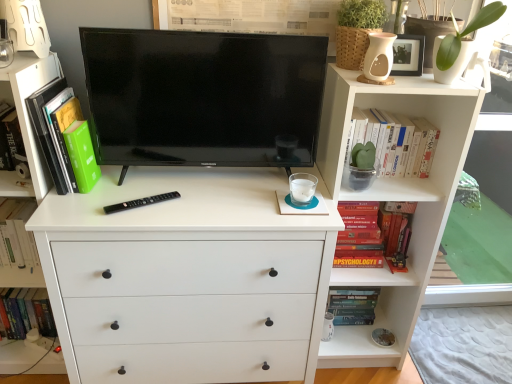
This screenshot has width=512, height=384. I want to click on vacant space to the right of green matte book at left, the second book viewed from the left, so click(x=122, y=193).